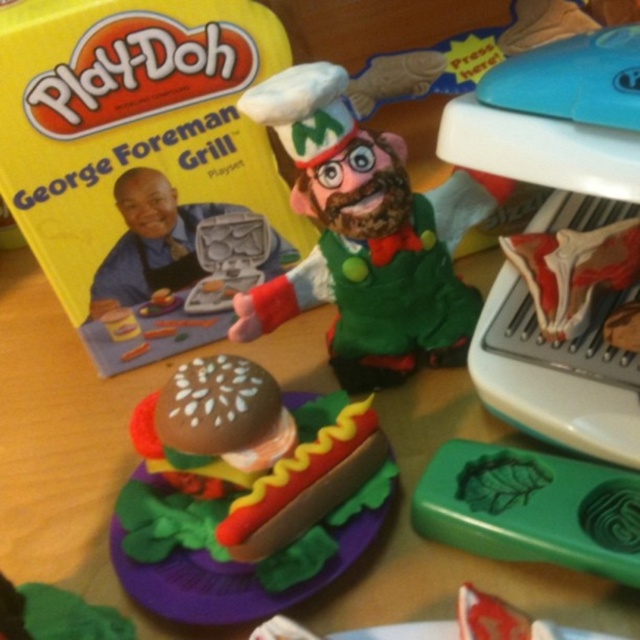
Question: Among these points, which one is farthest from the camera?

Choices:
 (A) (172, 502)
 (B) (468, 314)
 (C) (588, 467)

Answer: (B)

Question: Which object is the farthest from the green matte leaf at lower right?

Choices:
 (A) green felt chef at center
 (B) matte plastic hot dog at center

Answer: (A)

Question: Can you confirm if green felt chef at center is positioned above matte plastic hot dog at center?

Choices:
 (A) yes
 (B) no

Answer: (A)

Question: Which object is positioned closest to the matte plastic hot dog at center?

Choices:
 (A) green felt chef at center
 (B) green matte leaf at lower right

Answer: (B)

Question: Does green felt chef at center have a greater width compared to matte plastic hot dog at center?

Choices:
 (A) yes
 (B) no

Answer: (A)

Question: Can you confirm if green felt chef at center is positioned to the right of green matte leaf at lower right?

Choices:
 (A) yes
 (B) no

Answer: (B)